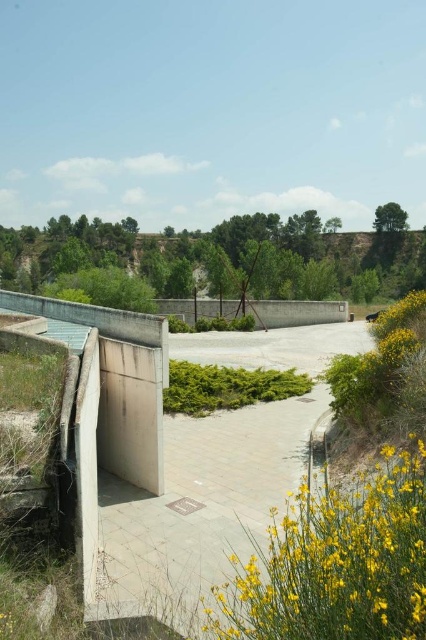
You are standing at the entrance of the pathway bordered by green shrubs and yellow flowers. You want to reach the metal framework in the middle ground. According to the coordinates provided, is the concrete wall at center located to the north or south of your current position?

The concrete wall at center is located at coordinates point (x=199, y=508). Since you are at the entrance of the pathway, which is in the foreground, your current position is likely at a lower coordinate. Therefore, the concrete wall at center is north of your current position.

You are standing at the point marked as point (x=199, y=508) in the image. What object is located exactly at that point?

The concrete wall at center is located exactly at point (x=199, y=508).